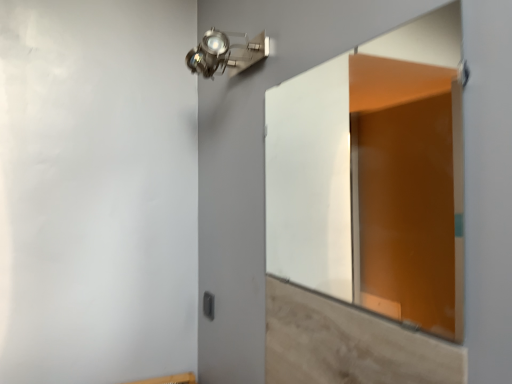
Locate an element on the screen. The width and height of the screenshot is (512, 384). black plastic switch at lower center is located at coordinates (208, 305).

Image resolution: width=512 pixels, height=384 pixels. What do you see at coordinates (208, 305) in the screenshot?
I see `black plastic switch at lower center` at bounding box center [208, 305].

Where is `transparent glass door at center`? transparent glass door at center is located at coordinates [x=372, y=175].

This screenshot has width=512, height=384. What do you see at coordinates (225, 53) in the screenshot?
I see `metallic spot light at upper center` at bounding box center [225, 53].

This screenshot has height=384, width=512. Identify the location of light brown wood at lower right. (348, 343).

From the image's perspective, does transparent glass door at center appear higher than black plastic switch at lower center?

Yes.

Is transparent glass door at center bigger than black plastic switch at lower center?

Correct, transparent glass door at center is larger in size than black plastic switch at lower center.

Is transparent glass door at center wider or thinner than black plastic switch at lower center?

In the image, transparent glass door at center appears to be wider than black plastic switch at lower center.

Where is `light switch to the left of transparent glass door at center`? The width and height of the screenshot is (512, 384). light switch to the left of transparent glass door at center is located at coordinates (208, 305).

Could you tell me if black plastic switch at lower center is turned towards metallic spot light at upper center?

No, black plastic switch at lower center is not aimed at metallic spot light at upper center.

Which is behind, point (212, 314) or point (217, 39)?

Positioned behind is point (212, 314).

Would you consider black plastic switch at lower center to be distant from metallic spot light at upper center?

No, black plastic switch at lower center is not far from metallic spot light at upper center.

Is point (221, 31) closer to viewer compared to point (209, 303)?

Yes, it is in front of point (209, 303).

Is metallic spot light at upper center shorter than black plastic switch at lower center?

Incorrect, the height of metallic spot light at upper center does not fall short of that of black plastic switch at lower center.

How far apart are metallic spot light at upper center and black plastic switch at lower center?

metallic spot light at upper center is 32.69 inches away from black plastic switch at lower center.

Considering their positions, is metallic spot light at upper center located in front of or behind black plastic switch at lower center?

metallic spot light at upper center is in front of black plastic switch at lower center.

Is light brown wood at lower right not close to metallic spot light at upper center?

No, there isn't a large distance between light brown wood at lower right and metallic spot light at upper center.

Is light brown wood at lower right positioned behind metallic spot light at upper center?

No, light brown wood at lower right is closer to the camera.

Is metallic spot light at upper center a part of light brown wood at lower right?

No, metallic spot light at upper center is not surrounded by light brown wood at lower right.

From a real-world perspective, between black plastic switch at lower center and transparent glass door at center, who is vertically higher?

transparent glass door at center is physically above.

Find the location of a particular element. Image resolution: width=512 pixels, height=384 pixels. light switch below the transparent glass door at center (from a real-world perspective) is located at coordinates (208, 305).

Does black plastic switch at lower center lie in front of transparent glass door at center?

No, it is behind transparent glass door at center.

Does point (211, 303) appear closer or farther from the camera than point (283, 179)?

Point (211, 303).

Would you say transparent glass door at center is a long distance from light brown wood at lower right?

transparent glass door at center is far away from light brown wood at lower right.

In the scene shown: How much distance is there between transparent glass door at center and light brown wood at lower right?

transparent glass door at center is 1.55 meters away from light brown wood at lower right.

In terms of height, does transparent glass door at center look taller or shorter compared to light brown wood at lower right?

Clearly, transparent glass door at center is taller compared to light brown wood at lower right.

Which object is closer to the camera, transparent glass door at center or light brown wood at lower right?

light brown wood at lower right is in front.

Can you tell me how much black plastic switch at lower center and light brown wood at lower right differ in facing direction?

The angular difference between black plastic switch at lower center and light brown wood at lower right is 1.17 degrees.

Is black plastic switch at lower center oriented away from light brown wood at lower right?

No, light brown wood at lower right is not at the back of black plastic switch at lower center.

Is black plastic switch at lower center wider or thinner than light brown wood at lower right?

black plastic switch at lower center is wider than light brown wood at lower right.

Are black plastic switch at lower center and light brown wood at lower right beside each other?

black plastic switch at lower center is not next to light brown wood at lower right, and they're not touching.

The image size is (512, 384). Find the location of `window lying in front of the black plastic switch at lower center`. window lying in front of the black plastic switch at lower center is located at coordinates (372, 175).

In the image, there is a black plastic switch at lower center. Where is `light fixture above it (from the image's perspective)`? Image resolution: width=512 pixels, height=384 pixels. light fixture above it (from the image's perspective) is located at coordinates coord(225,53).

From the image, which object appears to be nearer to black plastic switch at lower center, light brown wood at lower right or transparent glass door at center?

light brown wood at lower right is closer to black plastic switch at lower center.

Considering their positions, is black plastic switch at lower center positioned further to transparent glass door at center than light brown wood at lower right?

black plastic switch at lower center is further to transparent glass door at center.

Consider the image. From the image, which object appears to be farther from light brown wood at lower right, black plastic switch at lower center or metallic spot light at upper center?

Based on the image, black plastic switch at lower center appears to be further to light brown wood at lower right.

Considering their positions, is black plastic switch at lower center positioned further to light brown wood at lower right than transparent glass door at center?

transparent glass door at center is positioned further to the anchor light brown wood at lower right.

From the image, which object appears to be nearer to black plastic switch at lower center, metallic spot light at upper center or transparent glass door at center?

Based on the image, metallic spot light at upper center appears to be nearer to black plastic switch at lower center.

Looking at this image, estimate the real-world distances between objects in this image. Which object is closer to transparent glass door at center, metallic spot light at upper center or light brown wood at lower right?

metallic spot light at upper center.

Considering their positions, is metallic spot light at upper center positioned further to black plastic switch at lower center than light brown wood at lower right?

The object further to black plastic switch at lower center is metallic spot light at upper center.

Estimate the real-world distances between objects in this image. Which object is closer to transparent glass door at center, black plastic switch at lower center or metallic spot light at upper center?

metallic spot light at upper center lies closer to transparent glass door at center than the other object.

Where is `window positioned between light brown wood at lower right and black plastic switch at lower center from near to far`? window positioned between light brown wood at lower right and black plastic switch at lower center from near to far is located at coordinates (372, 175).

The height and width of the screenshot is (384, 512). I want to click on light fixture between transparent glass door at center and black plastic switch at lower center along the z-axis, so click(x=225, y=53).

Identify the location of window between metallic spot light at upper center and light brown wood at lower right in the up-down direction. This screenshot has height=384, width=512. (372, 175).

At what (x,y) coordinates should I click in order to perform the action: click on light fixture located between light brown wood at lower right and black plastic switch at lower center in the depth direction. Please return your answer as a coordinate pair (x, y). Looking at the image, I should click on [x=225, y=53].